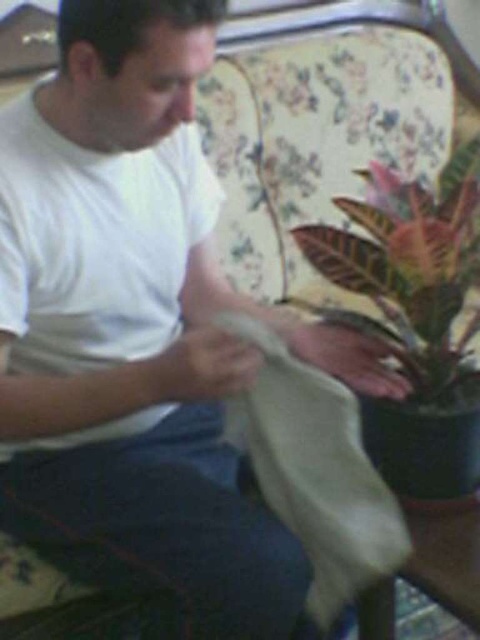
Question: Can you confirm if white matte t-shirt at left is wider than leathery green leaf at right?

Choices:
 (A) no
 (B) yes

Answer: (A)

Question: Which of the following is the closest to the observer?

Choices:
 (A) leathery green leaf at right
 (B) white matte t-shirt at left

Answer: (B)

Question: Can you confirm if white matte cloth at lower center is wider than leathery green leaf at right?

Choices:
 (A) no
 (B) yes

Answer: (A)

Question: Which object appears closest to the camera in this image?

Choices:
 (A) white matte cloth at lower center
 (B) white matte t-shirt at left

Answer: (B)

Question: Where is white matte t-shirt at left located in relation to white matte cloth at lower center in the image?

Choices:
 (A) left
 (B) right

Answer: (A)

Question: Which point is closer to the camera taking this photo?

Choices:
 (A) (44, 305)
 (B) (404, 266)
 (C) (358, 445)

Answer: (C)